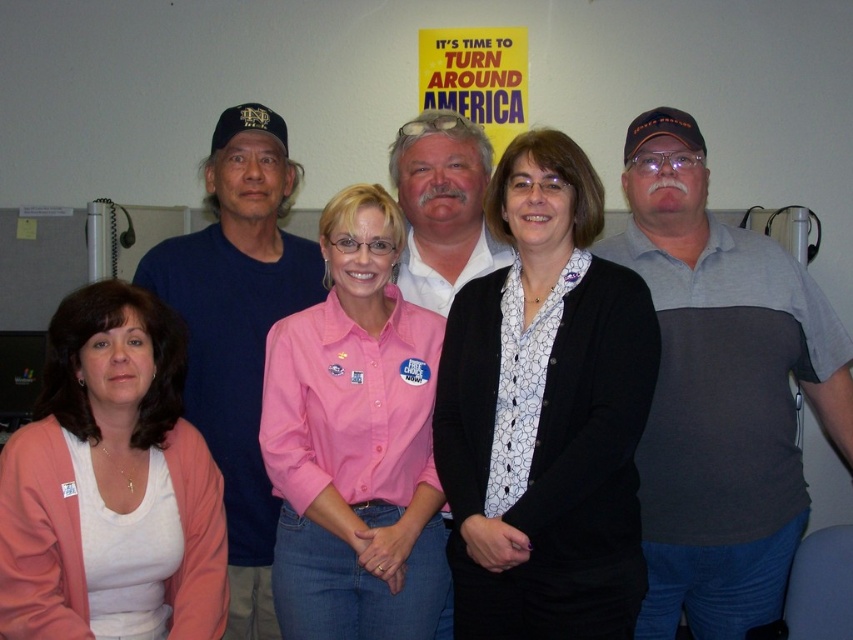
How far apart are pink fabric shirt at lower left and dark blue shirt at center?

They are 9.48 inches apart.

Does point (62, 429) lie in front of point (209, 349)?

Yes, it is.

At what (x,y) coordinates should I click in order to perform the action: click on pink fabric shirt at lower left. Please return your answer as a coordinate pair (x, y). This screenshot has width=853, height=640. Looking at the image, I should click on (111, 484).

Image resolution: width=853 pixels, height=640 pixels. What do you see at coordinates (111, 484) in the screenshot?
I see `pink fabric shirt at lower left` at bounding box center [111, 484].

Consider the image. Is pink fabric shirt at lower left bigger than white shirt at center?

Indeed, pink fabric shirt at lower left has a larger size compared to white shirt at center.

Image resolution: width=853 pixels, height=640 pixels. Identify the location of pink fabric shirt at lower left. (111, 484).

Identify the location of black textured blazer at center. (544, 413).

Locate an element on the screen. black textured blazer at center is located at coordinates (544, 413).

Locate an element on the screen. black textured blazer at center is located at coordinates (544, 413).